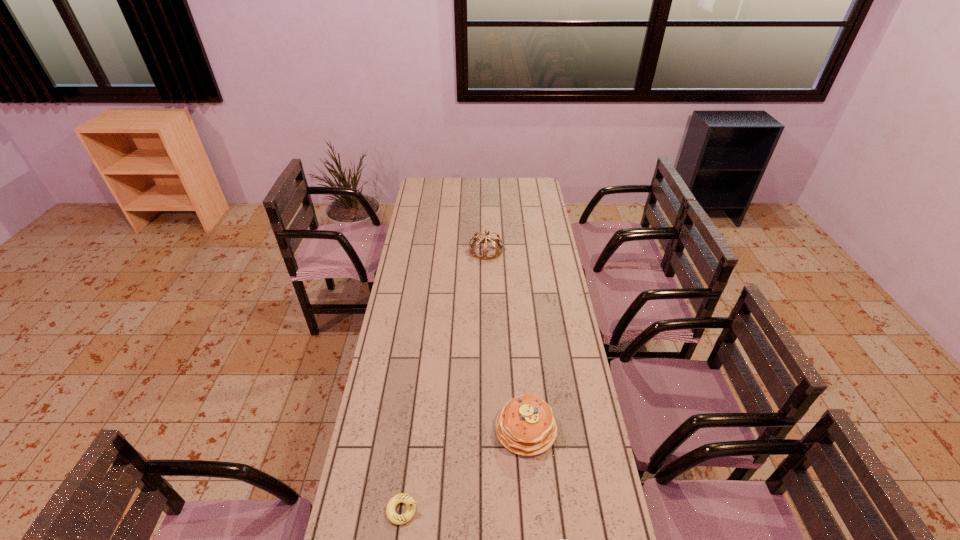
Locate an element on the screen. This screenshot has width=960, height=540. the farthest object is located at coordinates (495, 242).

The height and width of the screenshot is (540, 960). Find the location of `the farther pancake`. the farther pancake is located at coordinates (525, 426).

Identify the location of the second farthest object. The height and width of the screenshot is (540, 960). (525, 426).

Where is `the third farthest object`? Image resolution: width=960 pixels, height=540 pixels. the third farthest object is located at coordinates (395, 518).

What are the coordinates of `duckling` in the screenshot? It's located at (395, 518).

I want to click on vacant point located 0.280m on the front of the farthest object, so click(x=487, y=302).

Locate an element on the screen. vacant region located 0.300m on the left of the second farthest object is located at coordinates (404, 429).

Locate an element on the screen. Image resolution: width=960 pixels, height=540 pixels. vacant point located on the face of the second nearest object is located at coordinates (461, 510).

Locate an element on the screen. This screenshot has height=540, width=960. object located at the left edge is located at coordinates (395, 518).

The image size is (960, 540). Identify the location of object at the right edge. (525, 426).